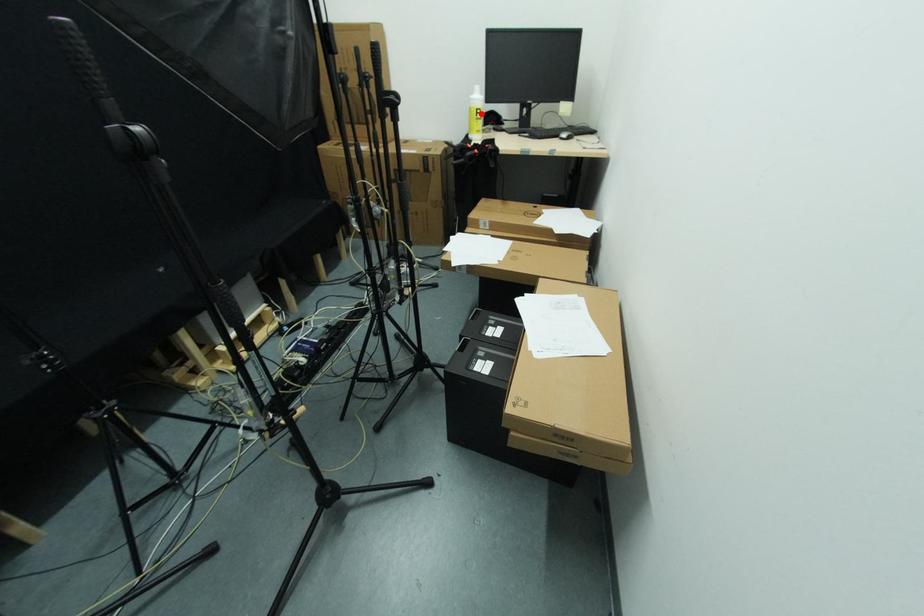
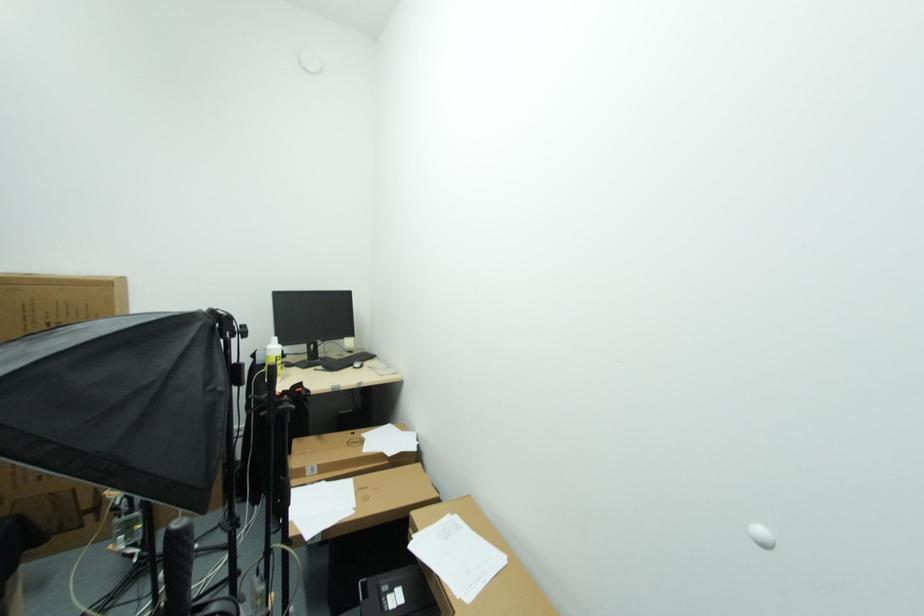
The point at the highlighted location is marked in the first image. Where is the corresponding point in the second image?

(280, 361)